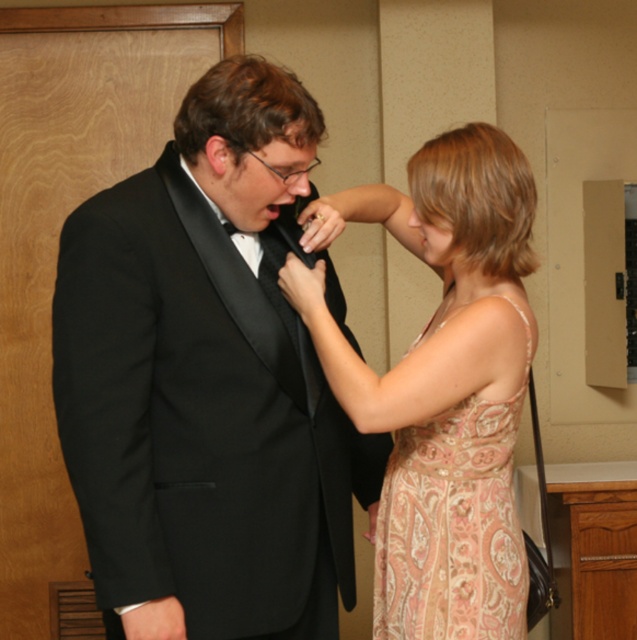
In the scene shown: What is the exact coordinate of the black satin tuxedo at center?

The black satin tuxedo at center is located at coordinate point (208, 381).